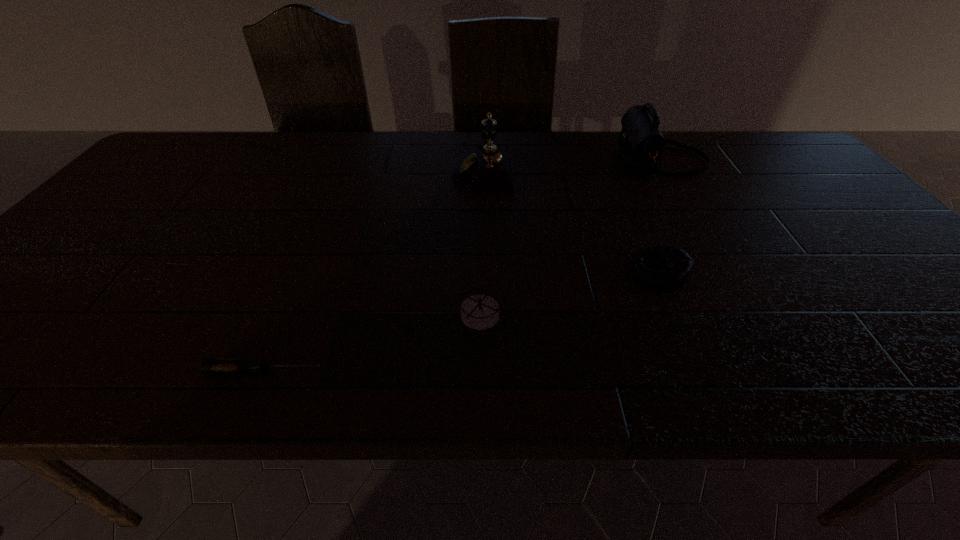
This screenshot has width=960, height=540. I want to click on free space located 0.120m on the back of the beanbag, so click(636, 225).

This screenshot has height=540, width=960. I want to click on vacant space located 0.160m on the back of the compass, so click(479, 249).

Locate an element on the screen. Image resolution: width=960 pixels, height=540 pixels. vacant space located insert the leftmost object into a screw head is located at coordinates (453, 370).

You are a GUI agent. You are given a task and a screenshot of the screen. Output one action in this format:
    pyautogui.click(x=<x>, y=<y>)
    Task: Click on the shoulder bag located at the far edge
    This screenshot has width=960, height=540.
    Given the screenshot: What is the action you would take?
    pyautogui.click(x=642, y=144)

I want to click on telephone at the far edge, so click(x=488, y=170).

The image size is (960, 540). I want to click on object present at the near edge, so click(x=209, y=365).

Locate an element on the screen. This screenshot has width=960, height=540. free space at the far edge of the desktop is located at coordinates (251, 144).

This screenshot has height=540, width=960. In the image, there is a desktop. Identify the location of free region at the near edge. (113, 360).

You are a GUI agent. You are given a task and a screenshot of the screen. Output one action in this format:
    pyautogui.click(x=<x>, y=<y>)
    Task: Click on the free point at the left edge
    
    Given the screenshot: What is the action you would take?
    pyautogui.click(x=170, y=197)

Where is `free space at the right edge of the desktop`? This screenshot has width=960, height=540. free space at the right edge of the desktop is located at coordinates (826, 243).